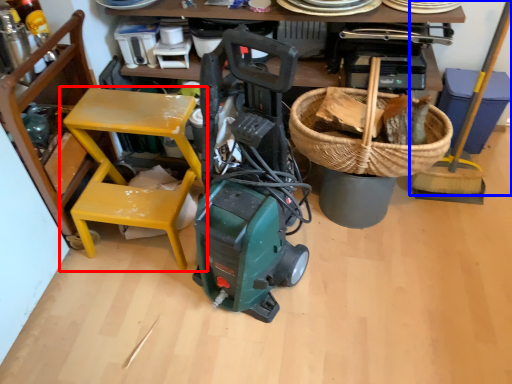
Question: Among these objects, which one is nearest to the camera, chair (highlighted by a red box) or shovel (highlighted by a blue box)?

Choices:
 (A) chair
 (B) shovel

Answer: (A)